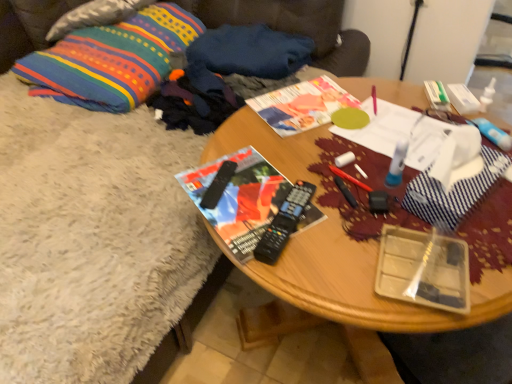
Where is `vacant space to the right of matte black magazine at center`? The image size is (512, 384). vacant space to the right of matte black magazine at center is located at coordinates (344, 196).